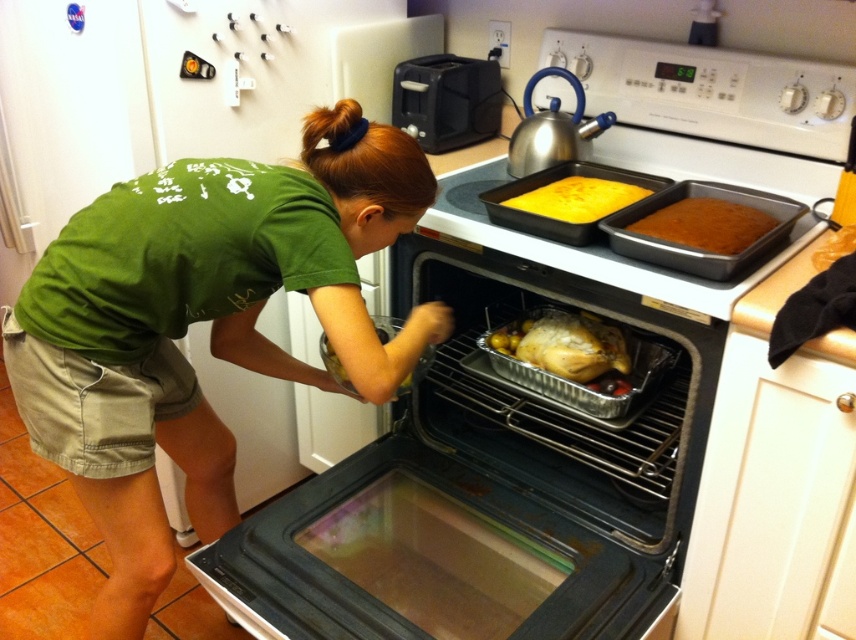
Which is in front, point (756, 209) or point (352, 392)?

Point (756, 209) is in front.

Who is positioned more to the right, brown matte cake at upper right or golden brown roasted chicken at center?

brown matte cake at upper right

Does point (699, 208) come behind point (375, 321)?

No.

Find the location of `brown matte cake at upper right`. brown matte cake at upper right is located at coordinates (705, 225).

Is point (548, 317) behind point (331, 362)?

Yes, it is.

Does silver metallic turkey at center come behind golden brown roasted chicken at center?

Yes, it is behind golden brown roasted chicken at center.

Measure the distance between silver metallic turkey at center and camera.

A distance of 4.91 feet exists between silver metallic turkey at center and camera.

You are a GUI agent. You are given a task and a screenshot of the screen. Output one action in this format:
    pyautogui.click(x=<x>, y=<y>)
    Task: Click on the silver metallic turkey at center
    Image resolution: width=856 pixels, height=640 pixels.
    Given the screenshot: What is the action you would take?
    pyautogui.click(x=565, y=346)

Does brown matte cake at upper right have a lesser height compared to yellow matte cake at upper center?

No, brown matte cake at upper right is not shorter than yellow matte cake at upper center.

Between brown matte cake at upper right and yellow matte cake at upper center, which one has more height?

brown matte cake at upper right

Between point (693, 216) and point (556, 182), which one is positioned in front?

Point (693, 216) is more forward.

Where is `brown matte cake at upper right`? brown matte cake at upper right is located at coordinates (705, 225).